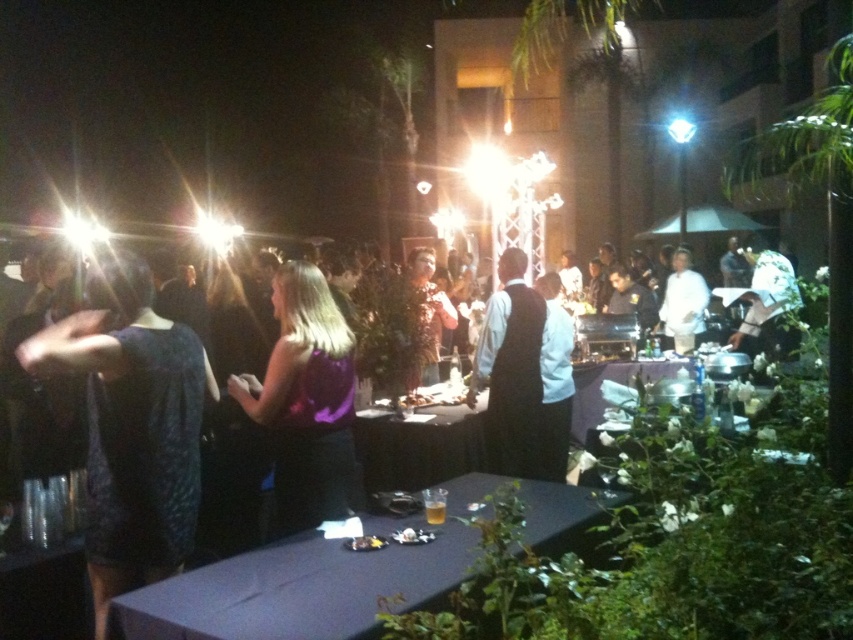
Between point (187, 536) and point (425, 358), which one is positioned behind?

The point (425, 358) is more distant.

Can you confirm if dark textured dress at left is thinner than floral-patterned dress at center?

No, dark textured dress at left is not thinner than floral-patterned dress at center.

The height and width of the screenshot is (640, 853). What do you see at coordinates (131, 426) in the screenshot?
I see `dark textured dress at left` at bounding box center [131, 426].

Where is `dark textured dress at left`? This screenshot has height=640, width=853. dark textured dress at left is located at coordinates (131, 426).

Can you confirm if dark textured dress at left is positioned to the left of white chef coat at center?

Indeed, dark textured dress at left is positioned on the left side of white chef coat at center.

Between dark textured dress at left and white chef coat at center, which one appears on the right side from the viewer's perspective?

From the viewer's perspective, white chef coat at center appears more on the right side.

Does point (198, 365) lie in front of point (675, 262)?

Yes, it is in front of point (675, 262).

The width and height of the screenshot is (853, 640). In order to click on dark textured dress at left in this screenshot , I will do `click(131, 426)`.

Can you confirm if dark textured dress at left is positioned above white fabric hat at upper right?

No.

Is dark textured dress at left to the left of white fabric hat at upper right from the viewer's perspective?

Yes, dark textured dress at left is to the left of white fabric hat at upper right.

The width and height of the screenshot is (853, 640). What do you see at coordinates (131, 426) in the screenshot?
I see `dark textured dress at left` at bounding box center [131, 426].

Locate an element on the screen. The width and height of the screenshot is (853, 640). dark textured dress at left is located at coordinates (131, 426).